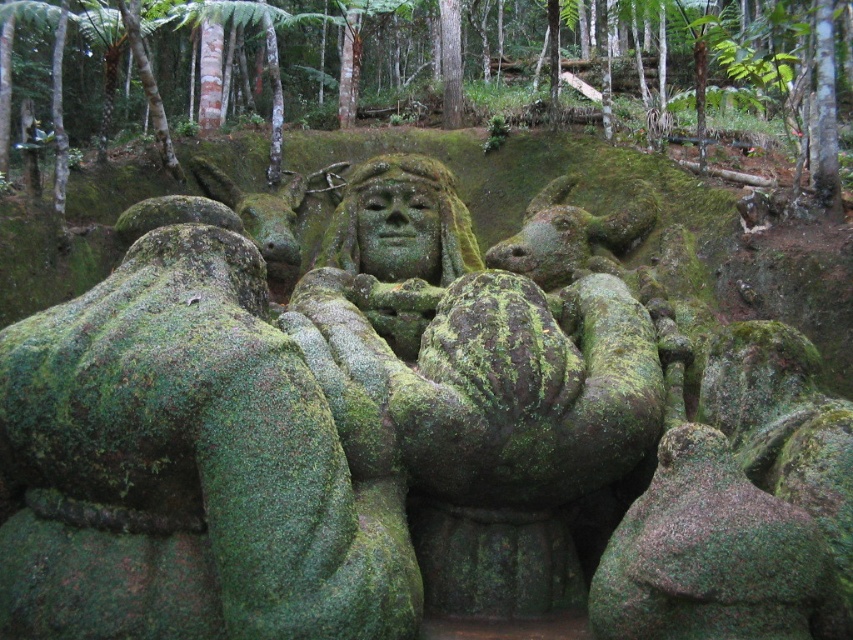
You are an archaeologist examining the green mossy statue at center and the green mossy face at center in the forest. Which object has a greater width?

The green mossy statue at center has a greater width than the green mossy face at center.

You are an archaeologist examining the green mossy statue at center and the green mossy face at center in the forest. Which part of the statue is positioned higher?

The green mossy statue at center is positioned higher than the green mossy face at center.

From the picture: You are a hiker who has stumbled upon the sculpture in the forest. You notice two green mossy features. Which one is positioned to the right when looking at the green mossy statue at center and the green mossy face at center?

The green mossy statue at center is to the right of the green mossy face at center.